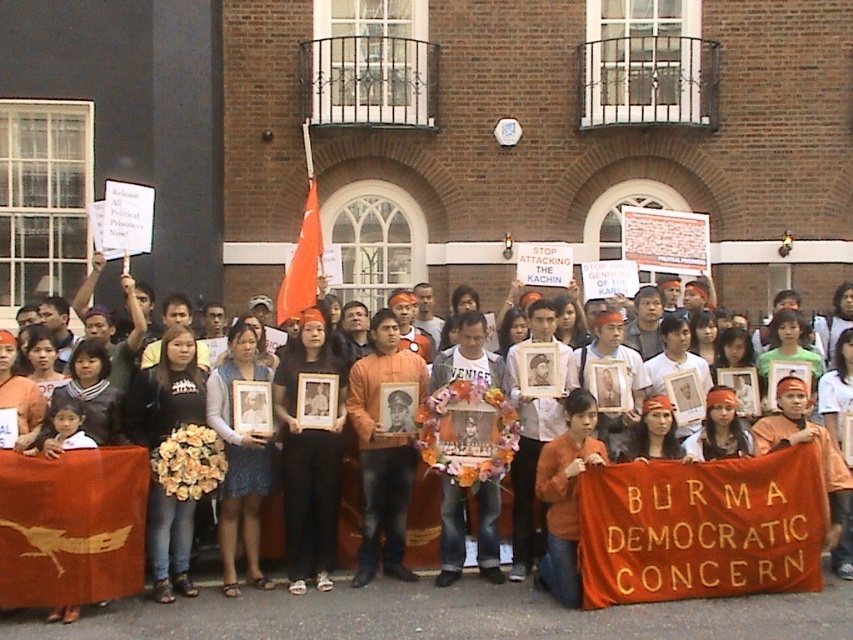
You are a photographer standing in front of the brick building and want to capture both the point at (306,598) and the point at (294,292) in your photo. Which point should you focus on first to ensure both are in clear view?

You should focus on point (306,598) first because it is closer to you than point (294,292), allowing both points to be in clear focus when using a shallow depth of field.